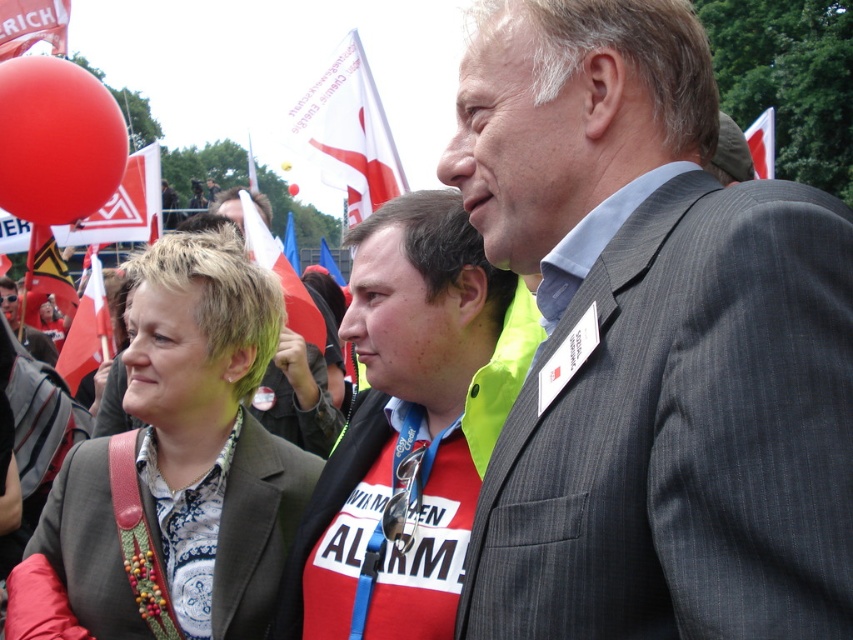
Question: Is red shirt at center below matte black jacket at center?

Choices:
 (A) no
 (B) yes

Answer: (B)

Question: Which of the following is the farthest from the observer?

Choices:
 (A) (78, 192)
 (B) (346, 611)
 (C) (13, 312)

Answer: (C)

Question: Does red shirt at center lie in front of matte black jacket at center?

Choices:
 (A) yes
 (B) no

Answer: (A)

Question: Which object is closer to the camera taking this photo?

Choices:
 (A) matte black jacket at center
 (B) gray pinstripe suit at center

Answer: (B)

Question: Can you confirm if red shirt at center is positioned below matte black jacket at center?

Choices:
 (A) yes
 (B) no

Answer: (A)

Question: Which point is closer to the camera taking this photo?

Choices:
 (A) 4,308
 (B) 270,492
 (C) 97,108

Answer: (B)